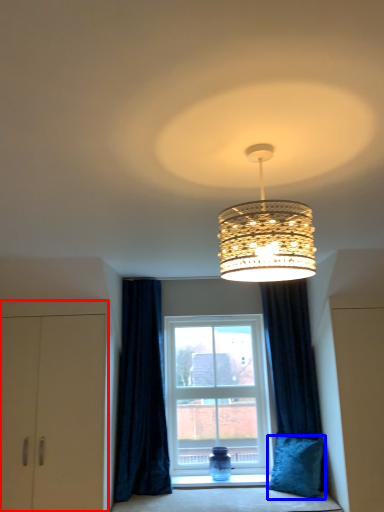
Question: Which of the following is the farthest to the observer, dresser (highlighted by a red box) or pillow (highlighted by a blue box)?

Choices:
 (A) dresser
 (B) pillow

Answer: (B)